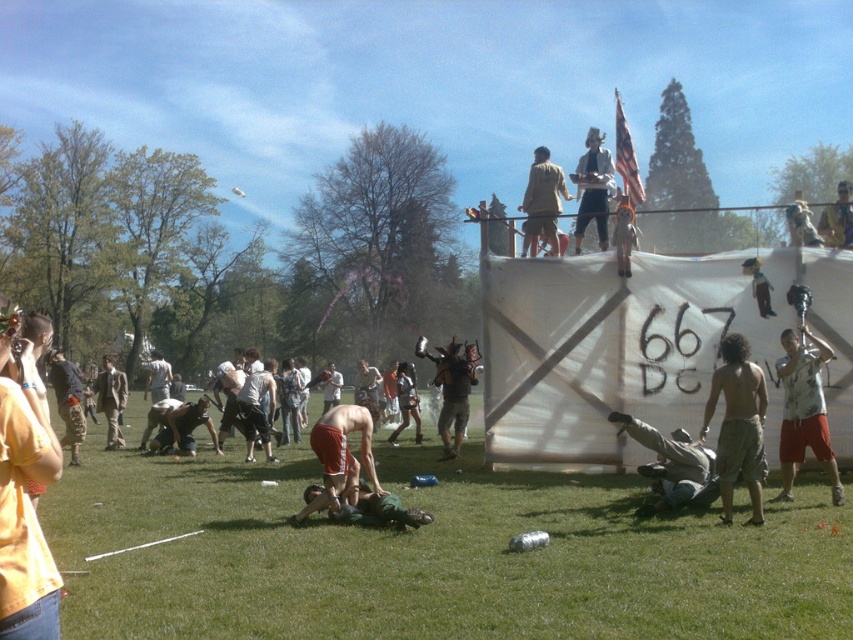
You are a photographer at the festival. You have a camera and need to capture a closeup shot of the shiny khaki shorts at lower right. The camera has a maximum zoom range of 10 meters. Can you take the photo without moving closer?

The shiny khaki shorts at lower right and camera are 9.85 meters apart from each other. Since the camera can zoom up to 10 meters, you can take the photo without moving closer.

You are standing in the park and see the green grass at lower center and the camouflage fabric person at lower center. Which one is closer to you?

The green grass at lower center is closer to the viewer than the camouflage fabric person at lower center.